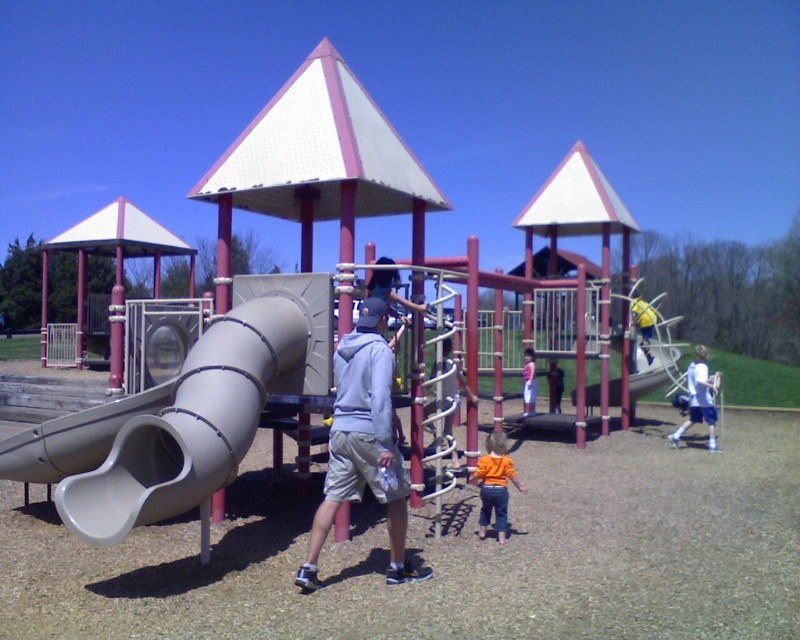
Question: Does gray rubber slide at left have a larger size compared to orange cotton shirt at center?

Choices:
 (A) no
 (B) yes

Answer: (B)

Question: Can you confirm if gray matte hoodie at center is wider than white jersey at right?

Choices:
 (A) yes
 (B) no

Answer: (B)

Question: Which object is positioned farthest from the gray matte hoodie at center?

Choices:
 (A) pink fabric dress at center
 (B) gray rubber slide at left
 (C) orange cotton shirt at center
 (D) smooth gray slide at center

Answer: (A)

Question: Which point is closer to the camera taking this photo?

Choices:
 (A) (640, 364)
 (B) (501, 481)

Answer: (B)

Question: Which point appears farthest from the camera in this image?

Choices:
 (A) (262, 323)
 (B) (716, 444)
 (C) (498, 467)

Answer: (B)

Question: Is smooth gray slide at center wider than orange cotton shirt at center?

Choices:
 (A) no
 (B) yes

Answer: (B)